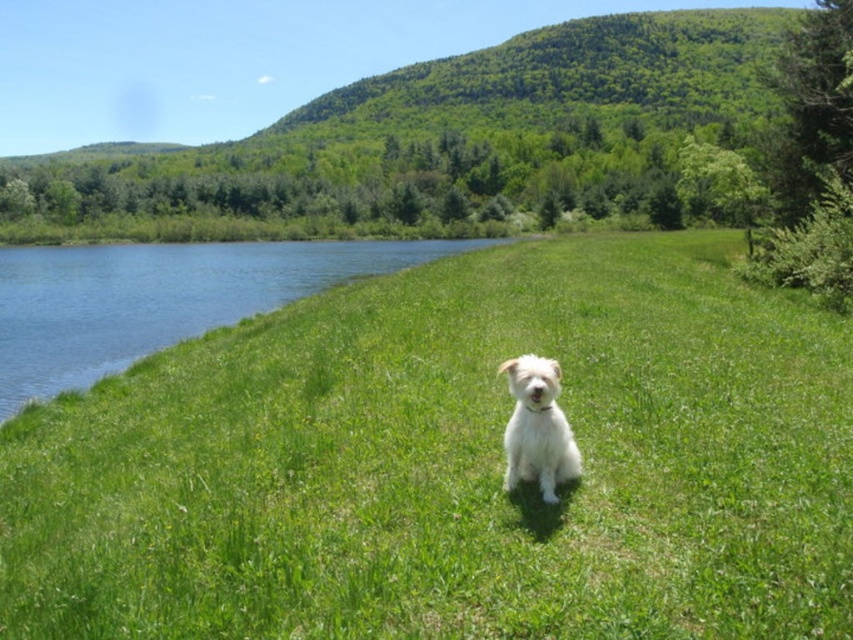
Is green grassy at center bigger than white fluffy dog at center?

Yes.

Is point (786, 570) less distant than point (515, 468)?

Yes, it is in front of point (515, 468).

This screenshot has height=640, width=853. What are the coordinates of `green grassy at center` in the screenshot? It's located at (453, 465).

Who is taller, blue water at left or white fluffy dog at center?

blue water at left is taller.

Can you confirm if blue water at left is smaller than white fluffy dog at center?

No.

Does point (59, 387) lie in front of point (514, 424)?

That is False.

Image resolution: width=853 pixels, height=640 pixels. Identify the location of blue water at left. (160, 298).

Is green grassy at center to the left of blue water at left from the viewer's perspective?

Result: Incorrect, green grassy at center is not on the left side of blue water at left.

Is point (258, 544) positioned after point (294, 272)?

No.

This screenshot has height=640, width=853. I want to click on green grassy at center, so coord(453,465).